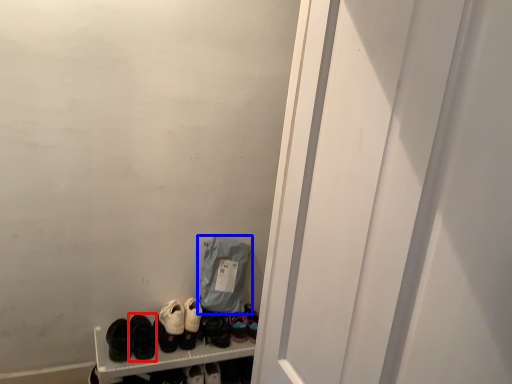
Question: Which object is further to the camera taking this photo, footwear (highlighted by a red box) or bag (highlighted by a blue box)?

Choices:
 (A) footwear
 (B) bag

Answer: (B)